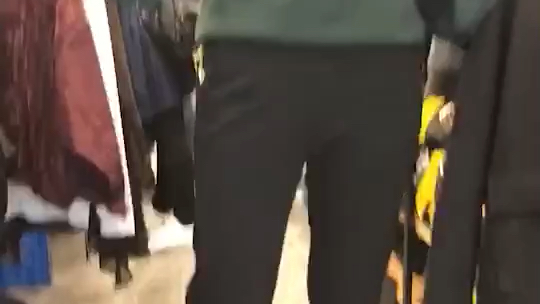
At what (x,y) coordinates should I click in order to perform the action: click on clothes on hangers. Please return your answer as a coordinate pair (x, y). Looking at the image, I should click on (76, 93), (160, 68), (124, 75), (110, 78).